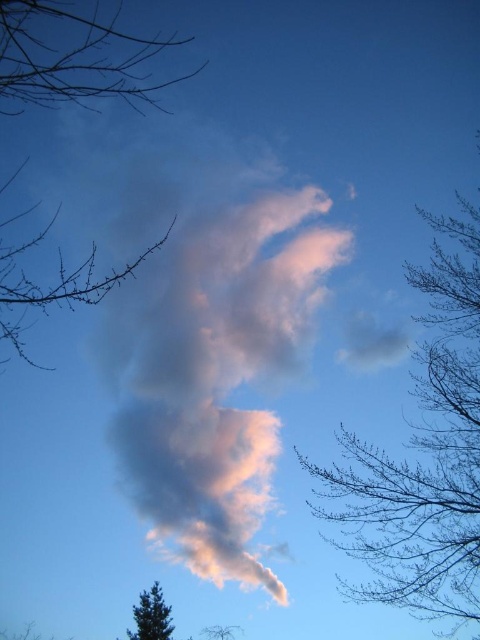
Can you confirm if brown bark tree at upper left is smaller than brown textured tree at lower left?

Incorrect, brown bark tree at upper left is not smaller in size than brown textured tree at lower left.

Who is shorter, brown bark tree at upper left or brown textured tree at lower left?

brown textured tree at lower left

Between point (110, 81) and point (216, 627), which one is positioned in front?

Point (110, 81)

Find the location of `brown bark tree at upper left`. brown bark tree at upper left is located at coordinates (71, 56).

From the picture: Which is more to the left, pearly white cloud at center or brown textured branches at upper left?

brown textured branches at upper left is more to the left.

Can you confirm if pearly white cloud at center is positioned above brown textured branches at upper left?

Actually, pearly white cloud at center is below brown textured branches at upper left.

Is point (167, 324) more distant than point (48, 0)?

Yes, it is.

This screenshot has height=640, width=480. What are the coordinates of `pearly white cloud at center` in the screenshot? It's located at (216, 376).

Which of these two, brown leafless branches at upper center or brown textured tree at lower left, stands taller?

brown leafless branches at upper center

Does brown leafless branches at upper center have a greater height compared to brown textured tree at lower left?

Yes.

Where is `brown leafless branches at upper center`? The image size is (480, 640). brown leafless branches at upper center is located at coordinates (422, 451).